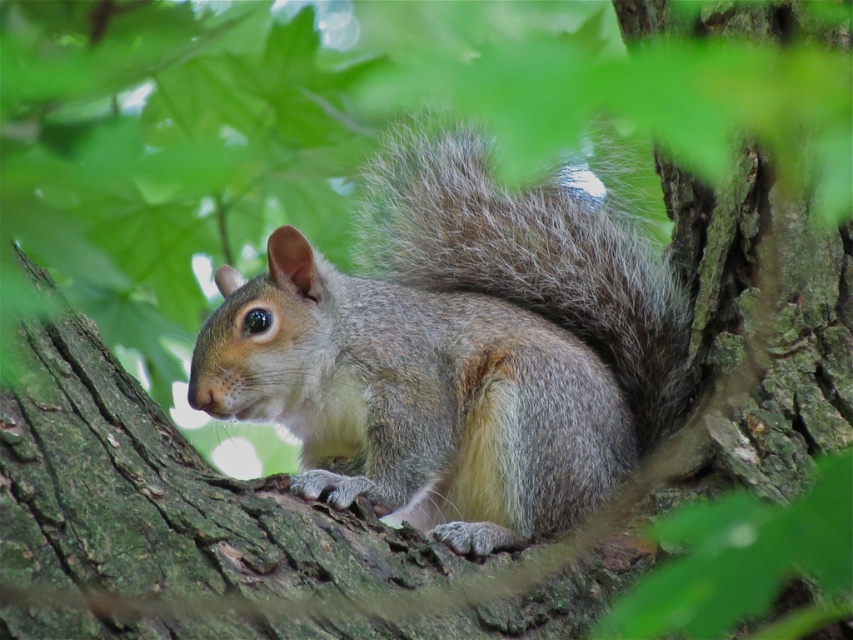
Question: Does gray fur squirrel at center have a larger size compared to brown rough tree trunk at center?

Choices:
 (A) yes
 (B) no

Answer: (A)

Question: From the image, what is the correct spatial relationship of gray fur squirrel at center in relation to brown rough tree trunk at center?

Choices:
 (A) right
 (B) left

Answer: (A)

Question: From the image, what is the correct spatial relationship of gray fur squirrel at center in relation to brown rough tree trunk at center?

Choices:
 (A) below
 (B) above

Answer: (B)